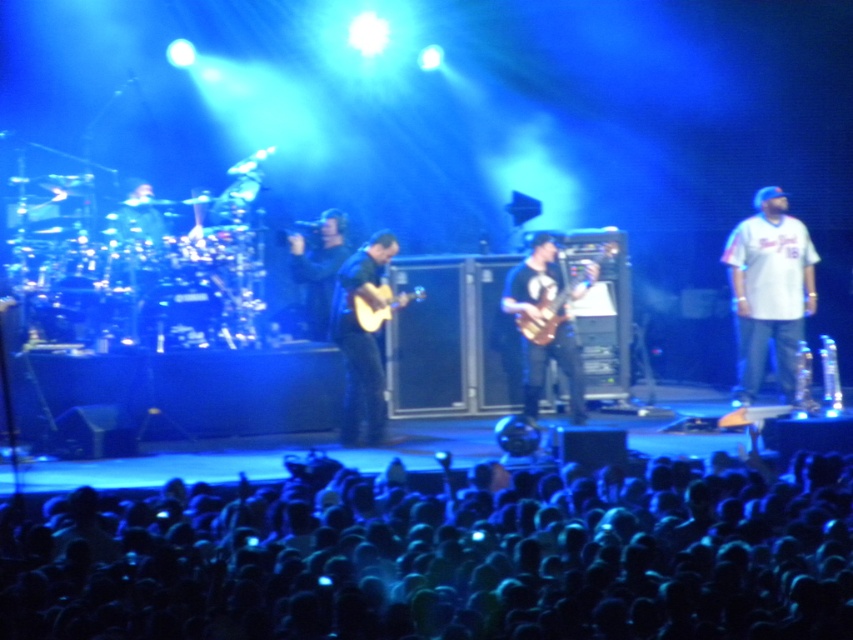
You are a photographer at the concert, and you want to capture a photo that includes both the black fabric crowd at lower center and the white cotton shirt at right. Which object will occupy more space in the photo?

The black fabric crowd at lower center will occupy more space in the photo because it has a larger size compared to the white cotton shirt at right.

You are a photographer at the concert and want to capture a photo of both the white cotton shirt at right and the black matte jacket at center. Which one will appear larger in the photo?

The white cotton shirt at right appears larger in the photo because it is closer to the viewer than the black matte jacket at center.

You are standing at the point marked as point [457,566] in the concert venue. What is the nearest object to you?

The nearest object to you is the black fabric crowd at lower center located at point [457,566].